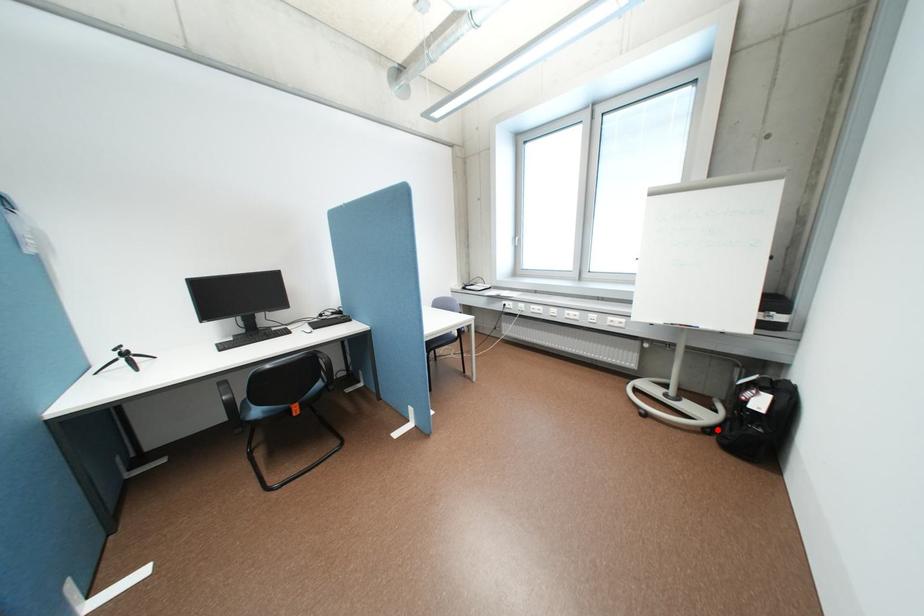
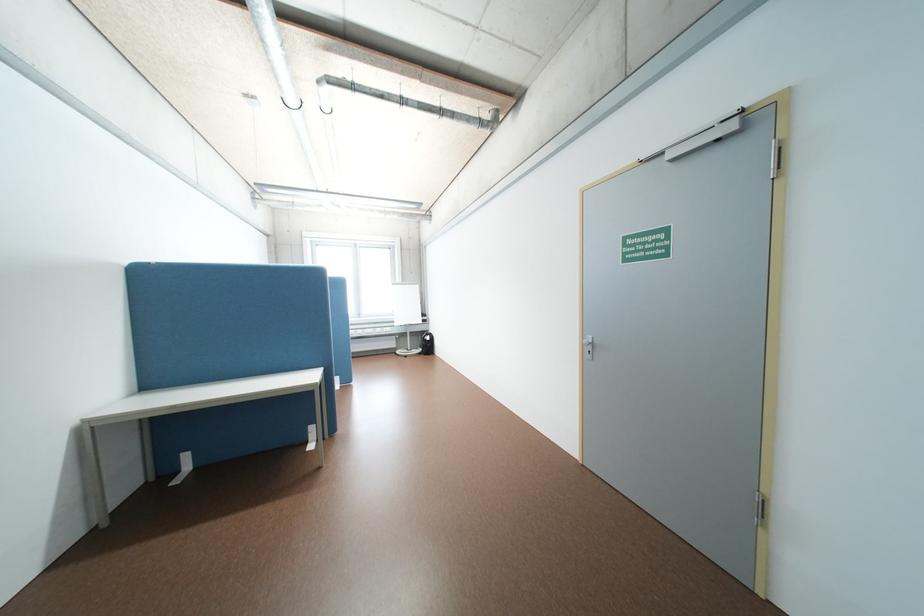
In the second image, find the point that corresponds to the highlighted location in the first image.

(431, 353)